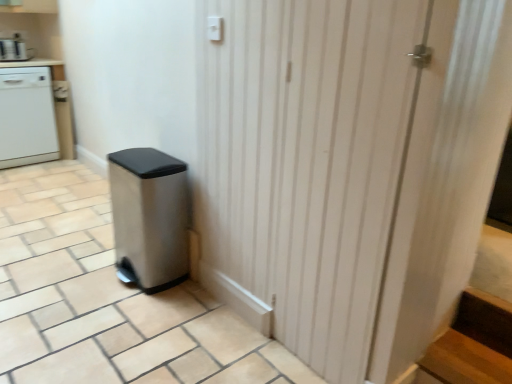
This screenshot has width=512, height=384. I want to click on vacant area situated below white wood screen door at center (from a real-world perspective), so click(x=262, y=336).